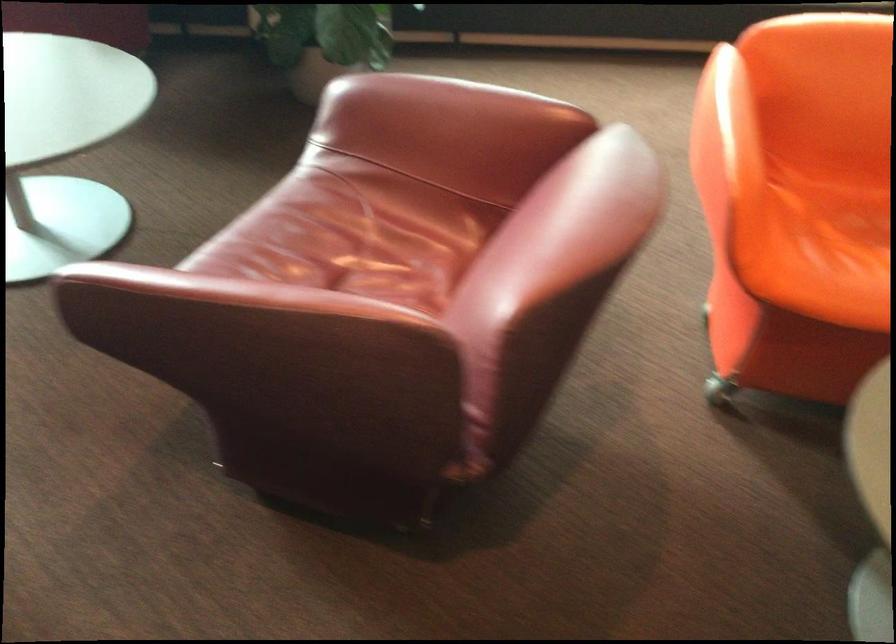
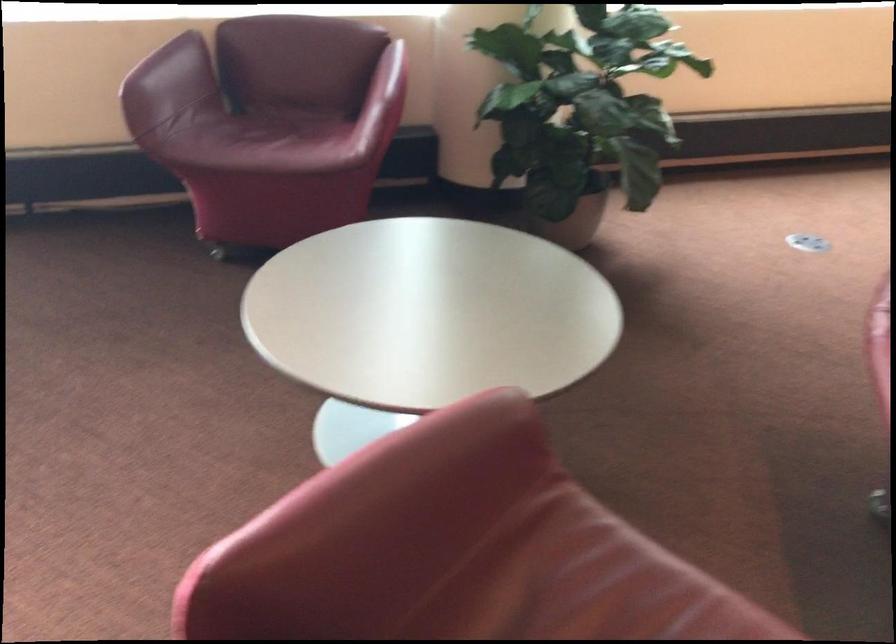
Question: The images are taken continuously from a first-person perspective. In which direction are you moving?

Choices:
 (A) Left
 (B) Right
 (C) Forward
 (D) Backward

Answer: (A)